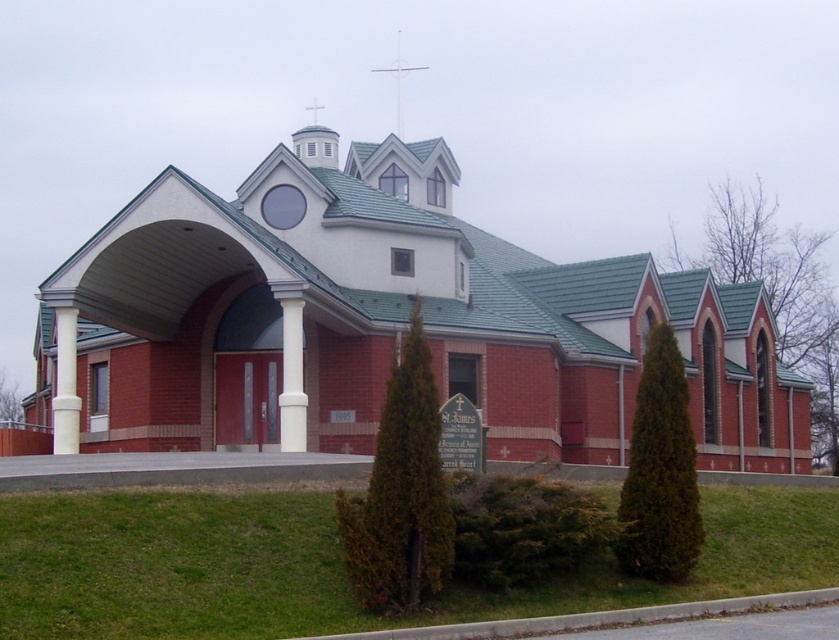
You are standing in front of the modern church building. The red brick chapel at center is located at point (389, 321). If you want to find the exact location of the chapel, where should you look?

The red brick chapel at center is located at point (389, 321), so you should look at the center of the image to find its exact location.

You are standing at the entrance of the modern church and looking towards the central tower. Where is the white smooth column at center located in relation to your position?

The white smooth column at center is located at point (292, 378), which is to the right and slightly above your current position at the entrance.

You are a drone operator tasked with capturing aerial footage of the red brick chapel at center and the white metal cross at upper center. The minimum safe distance between the drone and any object is 10 meters. Can you fly the drone between them without violating the safety regulations?

The red brick chapel at center and the white metal cross at upper center are 68.94 meters apart. Since the minimum safe distance is 10 meters, the drone can safely fly between them as the distance between the two objects is well above the required safety margin.